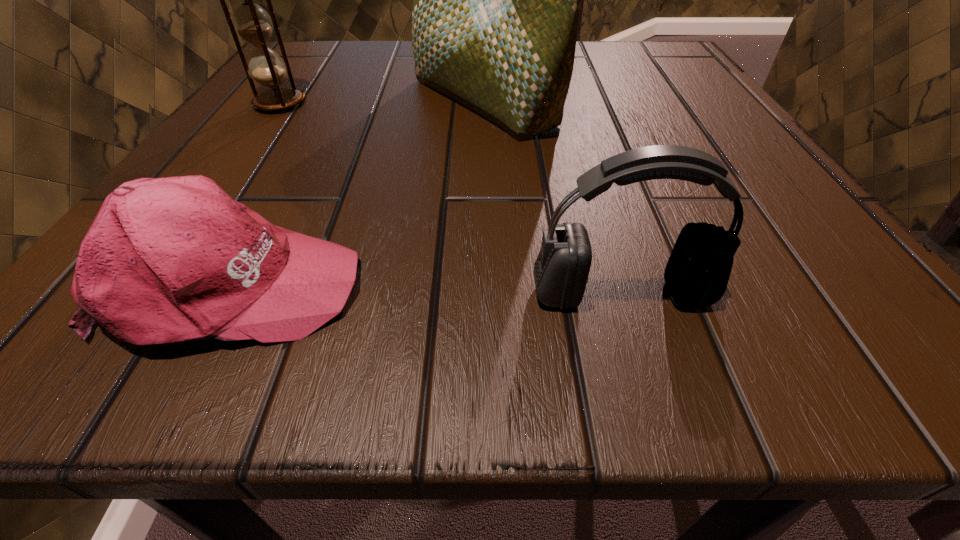
In order to click on free region at the far left corner of the desktop in this screenshot , I will do `click(316, 69)`.

Identify the location of free spot at the far right corner of the desktop. (695, 90).

Image resolution: width=960 pixels, height=540 pixels. In order to click on free spot at the near right corner of the desktop in this screenshot , I will do `click(797, 296)`.

The height and width of the screenshot is (540, 960). Identify the location of free spot between the tallest object and the hourglass. (381, 103).

Where is `free area in between the hourglass and the shopping bag`? The width and height of the screenshot is (960, 540). free area in between the hourglass and the shopping bag is located at coordinates (381, 103).

At what (x,y) coordinates should I click in order to perform the action: click on free spot between the shopping bag and the shortest object. Please return your answer as a coordinate pair (x, y). The height and width of the screenshot is (540, 960). Looking at the image, I should click on (358, 193).

What are the coordinates of `free area in between the hourglass and the shopping bag` in the screenshot? It's located at (381, 103).

The height and width of the screenshot is (540, 960). Find the location of `free space between the tallest object and the headset`. free space between the tallest object and the headset is located at coordinates (552, 198).

Where is `vacant area between the baseball cap and the headset`? The width and height of the screenshot is (960, 540). vacant area between the baseball cap and the headset is located at coordinates (427, 289).

The image size is (960, 540). Find the location of `vacant area between the headset and the shortest object`. vacant area between the headset and the shortest object is located at coordinates (427, 289).